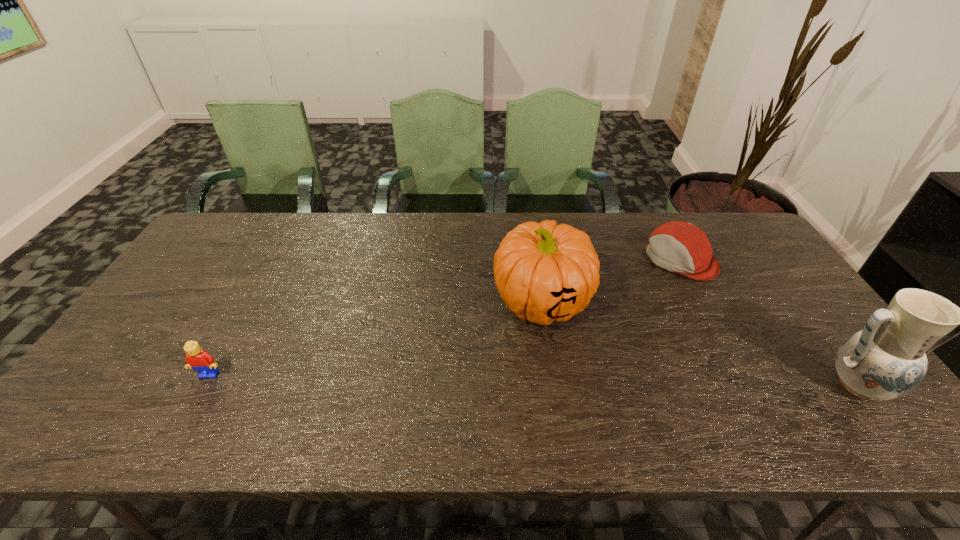
You are a GUI agent. You are given a task and a screenshot of the screen. Output one action in this format:
    pyautogui.click(x=<x>, y=<y>)
    Task: Click on the vacant point located 0.250m on the front-facing side of the cap
    This screenshot has height=540, width=960.
    Given the screenshot: What is the action you would take?
    pyautogui.click(x=612, y=314)

Where is `object that is at the far edge`? The height and width of the screenshot is (540, 960). object that is at the far edge is located at coordinates pos(680,247).

The height and width of the screenshot is (540, 960). Identify the location of Lego that is at the near edge. (198, 359).

At what (x,y) coordinates should I click in order to perform the action: click on pottery that is at the near edge. Please return your answer as a coordinate pair (x, y). The height and width of the screenshot is (540, 960). Looking at the image, I should click on (887, 359).

The height and width of the screenshot is (540, 960). What are the coordinates of `object that is at the right edge` in the screenshot? It's located at (887, 359).

Locate an element on the screen. object at the near right corner is located at coordinates (887, 359).

Locate an element on the screen. The image size is (960, 540). vacant space at the far edge of the desktop is located at coordinates (421, 215).

Locate an element on the screen. free region at the near edge of the desktop is located at coordinates (468, 380).

Find the location of a particular element. The image size is (960, 540). vacant space at the left edge of the desktop is located at coordinates (175, 290).

Where is `vacant region at the right edge of the desktop`? vacant region at the right edge of the desktop is located at coordinates (758, 269).